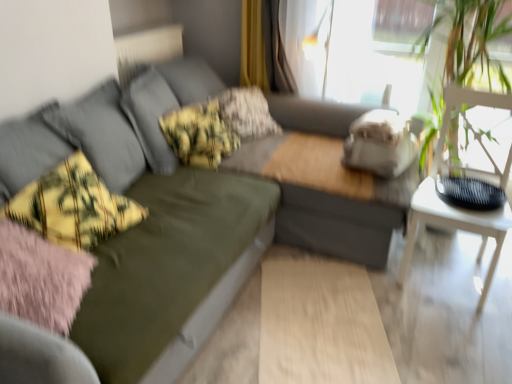
Question: Can you confirm if white wooden table at right is thinner than yellow-green plaid throw pillow at left?

Choices:
 (A) yes
 (B) no

Answer: (B)

Question: Can you confirm if white wooden table at right is positioned to the left of yellow-green plaid throw pillow at left?

Choices:
 (A) yes
 (B) no

Answer: (B)

Question: Is white wooden table at right at the right side of yellow-green plaid throw pillow at left?

Choices:
 (A) yes
 (B) no

Answer: (A)

Question: Are white wooden table at right and yellow-green plaid throw pillow at left far apart?

Choices:
 (A) yes
 (B) no

Answer: (A)

Question: From a real-world perspective, is white wooden table at right below yellow-green plaid throw pillow at left?

Choices:
 (A) no
 (B) yes

Answer: (B)

Question: Visually, is olive green fabric couch at center positioned to the left or to the right of yellow-green plaid throw pillow at left?

Choices:
 (A) left
 (B) right

Answer: (B)

Question: In terms of width, does olive green fabric couch at center look wider or thinner when compared to yellow-green plaid throw pillow at left?

Choices:
 (A) thin
 (B) wide

Answer: (B)

Question: From a real-world perspective, is olive green fabric couch at center positioned above or below yellow-green plaid throw pillow at left?

Choices:
 (A) above
 (B) below

Answer: (B)

Question: Is point (308, 122) positioned closer to the camera than point (31, 215)?

Choices:
 (A) closer
 (B) farther

Answer: (B)

Question: From a real-world perspective, is white textured radiator at upper left physically located above or below yellow-green plaid pillow at center, which is the 2th pillow from back to front?

Choices:
 (A) below
 (B) above

Answer: (B)

Question: Considering the positions of white textured radiator at upper left and yellow-green plaid pillow at center, which is the 2th pillow from back to front, in the image, is white textured radiator at upper left taller or shorter than yellow-green plaid pillow at center, which is the 2th pillow from back to front,?

Choices:
 (A) short
 (B) tall

Answer: (A)

Question: Is white textured radiator at upper left bigger or smaller than yellow-green plaid pillow at center, the 1th pillow in the front-to-back sequence?

Choices:
 (A) big
 (B) small

Answer: (B)

Question: Looking at their shapes, would you say white textured radiator at upper left is wider or thinner than yellow-green plaid pillow at center, which is the 2th pillow from back to front?

Choices:
 (A) wide
 (B) thin

Answer: (B)

Question: In terms of height, does yellow-green plaid throw pillow at left look taller or shorter compared to olive green fabric couch at center?

Choices:
 (A) short
 (B) tall

Answer: (A)

Question: From a real-world perspective, is yellow-green plaid throw pillow at left physically located above or below olive green fabric couch at center?

Choices:
 (A) above
 (B) below

Answer: (A)